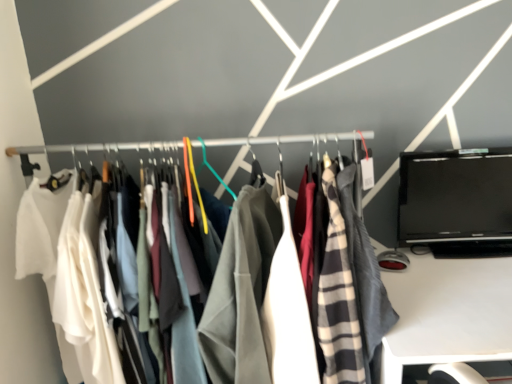
Question: From the image's perspective, is white plastic desk at lower right above matte fabric clothes at center?

Choices:
 (A) yes
 (B) no

Answer: (B)

Question: Can you confirm if white plastic desk at lower right is smaller than matte fabric clothes at center?

Choices:
 (A) yes
 (B) no

Answer: (A)

Question: Is white plastic desk at lower right far from matte fabric clothes at center?

Choices:
 (A) no
 (B) yes

Answer: (A)

Question: Does white plastic desk at lower right have a larger size compared to matte fabric clothes at center?

Choices:
 (A) no
 (B) yes

Answer: (A)

Question: Can you confirm if white plastic desk at lower right is wider than matte fabric clothes at center?

Choices:
 (A) yes
 (B) no

Answer: (A)

Question: Can you confirm if white plastic desk at lower right is positioned to the left of matte fabric clothes at center?

Choices:
 (A) yes
 (B) no

Answer: (B)

Question: Is black glossy laptop at right to the right of matte fabric clothes at center from the viewer's perspective?

Choices:
 (A) yes
 (B) no

Answer: (A)

Question: Is black glossy laptop at right aimed at matte fabric clothes at center?

Choices:
 (A) yes
 (B) no

Answer: (B)

Question: Is black glossy laptop at right outside of matte fabric clothes at center?

Choices:
 (A) yes
 (B) no

Answer: (A)

Question: From the image's perspective, is black glossy laptop at right located beneath matte fabric clothes at center?

Choices:
 (A) no
 (B) yes

Answer: (A)

Question: From a real-world perspective, is black glossy laptop at right positioned under matte fabric clothes at center based on gravity?

Choices:
 (A) yes
 (B) no

Answer: (B)

Question: Does black glossy laptop at right lie behind matte fabric clothes at center?

Choices:
 (A) no
 (B) yes

Answer: (B)

Question: Can you confirm if black glossy laptop at right is bigger than white plastic desk at lower right?

Choices:
 (A) no
 (B) yes

Answer: (A)